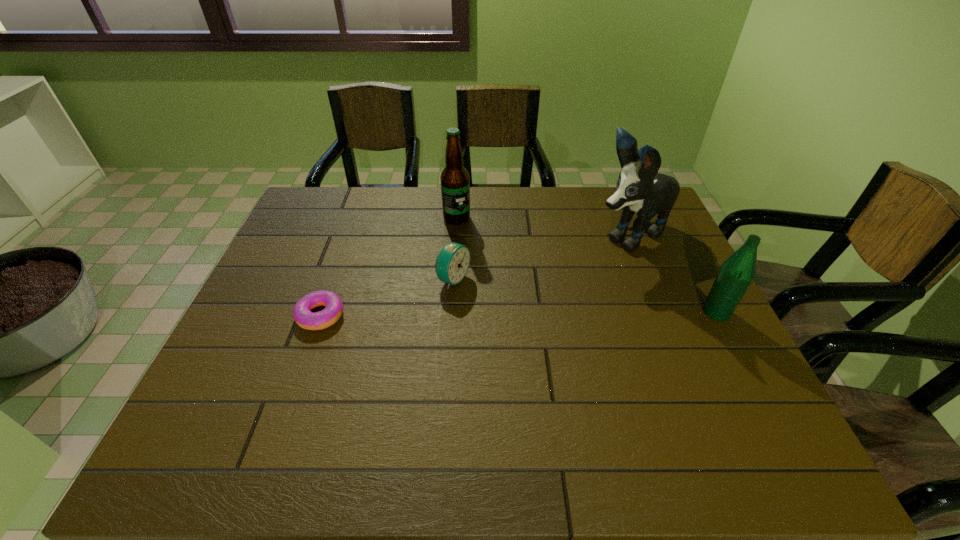
The width and height of the screenshot is (960, 540). I want to click on object that is at the left edge, so click(x=303, y=316).

Identify the location of bottle that is at the right edge. (735, 275).

Where is `puppy at the right edge`? puppy at the right edge is located at coordinates (640, 188).

The height and width of the screenshot is (540, 960). Find the location of `object present at the far right corner`. object present at the far right corner is located at coordinates tap(640, 188).

Find the location of `free location at the far edge`. free location at the far edge is located at coordinates (497, 212).

This screenshot has width=960, height=540. Identify the location of free region at the near edge of the desktop. (575, 407).

Identify the location of vacant space at the left edge of the desktop. This screenshot has height=540, width=960. (316, 278).

Locate an element on the screen. Image resolution: width=960 pixels, height=540 pixels. free point at the right edge is located at coordinates (720, 352).

The image size is (960, 540). In the image, there is a desktop. Identify the location of vacant space at the far left corner. (340, 187).

In the image, there is a desktop. In order to click on vacant space at the near left corner in this screenshot , I will do [x=252, y=382].